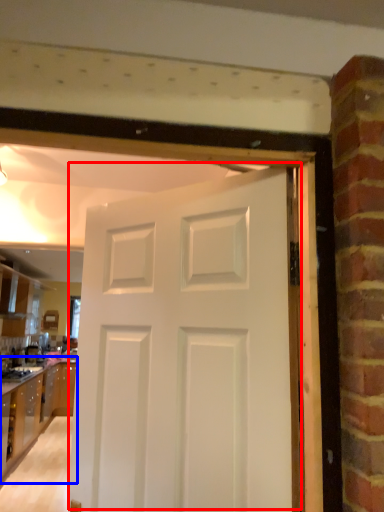
Question: Among these objects, which one is nearest to the camera, door (highlighted by a red box) or cabinetry (highlighted by a blue box)?

Choices:
 (A) door
 (B) cabinetry

Answer: (A)